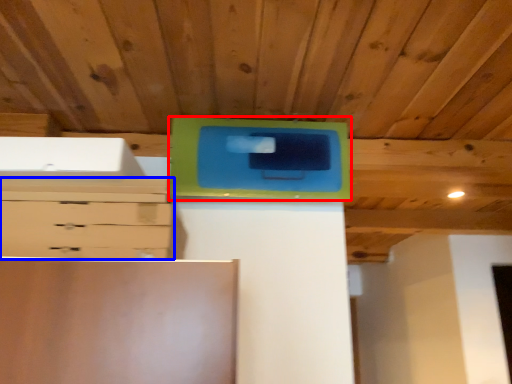
Question: Among these objects, which one is nearest to the camera, cabinetry (highlighted by a red box) or chest of drawers (highlighted by a blue box)?

Choices:
 (A) cabinetry
 (B) chest of drawers

Answer: (B)